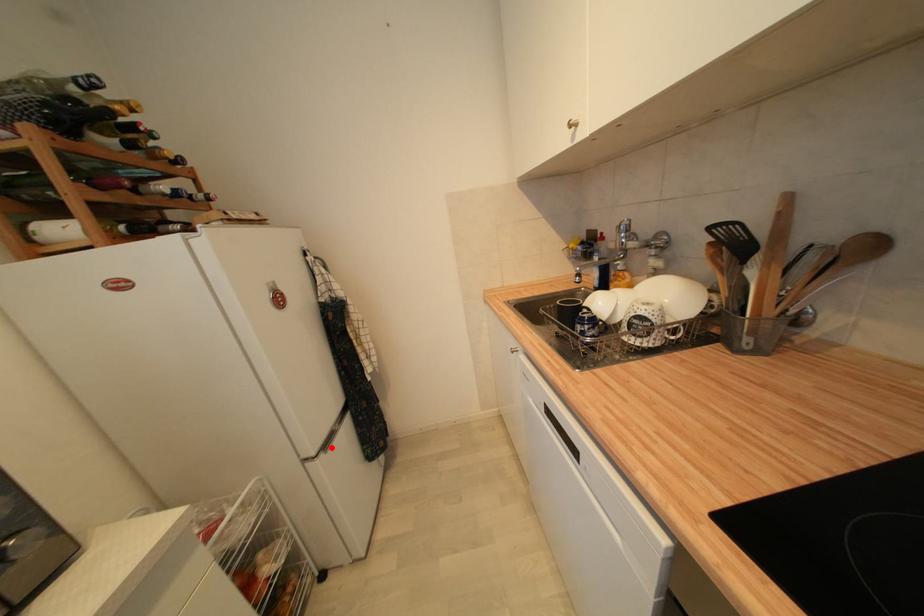
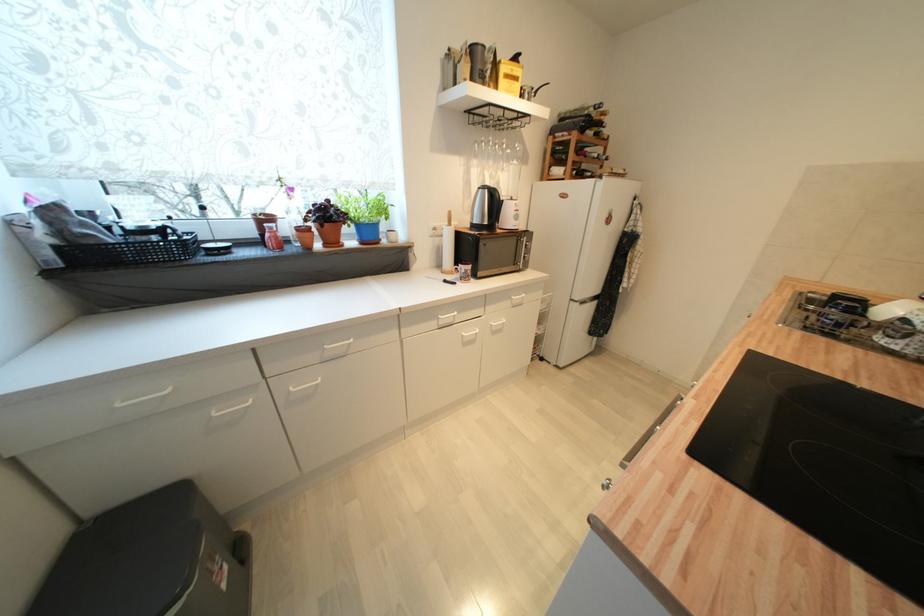
In the second image, find the point that corresponds to the highlighted location in the first image.

(587, 304)